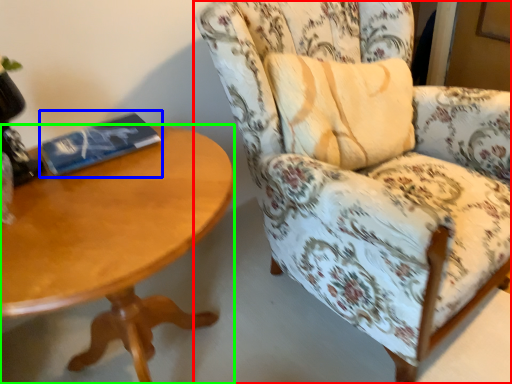
Question: Estimate the real-world distances between objects in this image. Which object is closer to chair (highlighted by a red box), paperback book (highlighted by a blue box) or coffee table (highlighted by a green box)?

Choices:
 (A) paperback book
 (B) coffee table

Answer: (B)